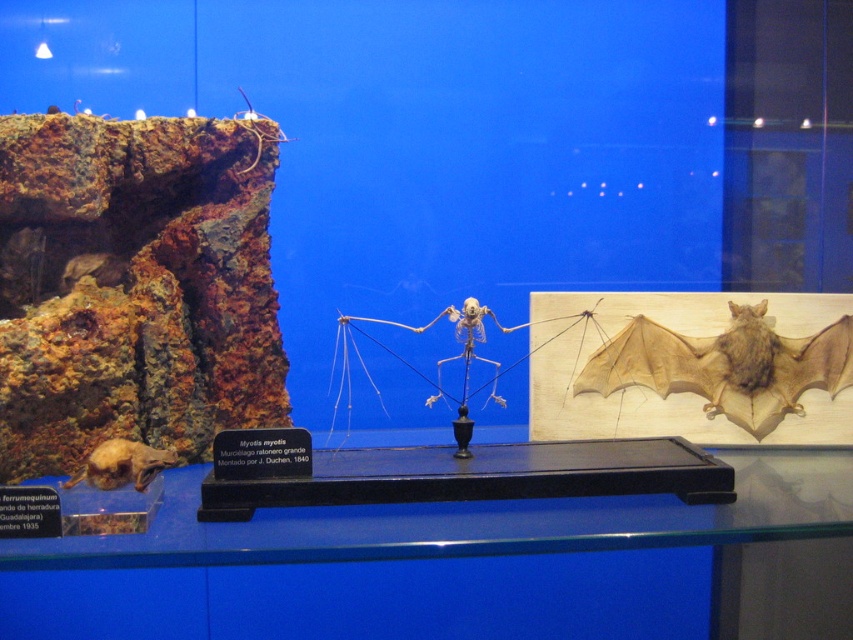
Question: Where is brown leather bat at center located in relation to brown furry bat at lower left in the image?

Choices:
 (A) above
 (B) below

Answer: (A)

Question: Which of the following is the farthest from the observer?

Choices:
 (A) (170, 452)
 (B) (734, 301)

Answer: (B)

Question: Does brown leather bat at center appear on the left side of brown furry bat at lower left?

Choices:
 (A) no
 (B) yes

Answer: (A)

Question: Which of the following is the closest to the observer?

Choices:
 (A) (123, 449)
 (B) (633, 333)

Answer: (A)

Question: Which point is closer to the camera?

Choices:
 (A) brown leather bat at center
 (B) brown furry bat at lower left

Answer: (B)

Question: Is brown leather bat at center positioned before brown furry bat at lower left?

Choices:
 (A) no
 (B) yes

Answer: (A)